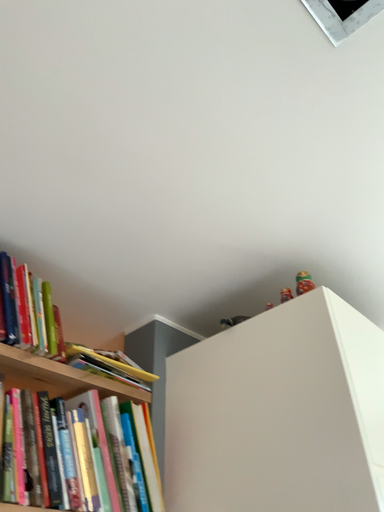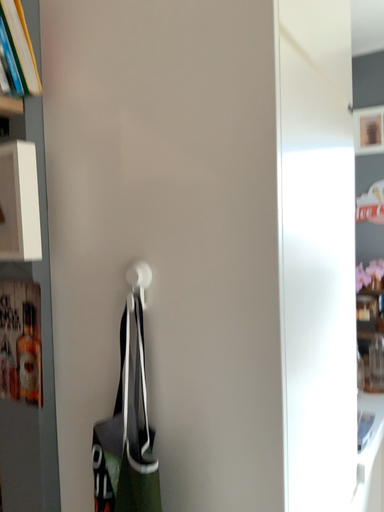
Question: Which way did the camera rotate in the video?

Choices:
 (A) rotated right
 (B) rotated left

Answer: (A)